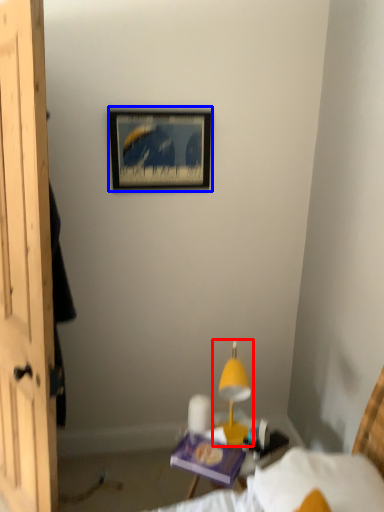
Question: Which of the following is the farthest to the observer, table lamp (highlighted by a red box) or picture frame (highlighted by a blue box)?

Choices:
 (A) table lamp
 (B) picture frame

Answer: (B)